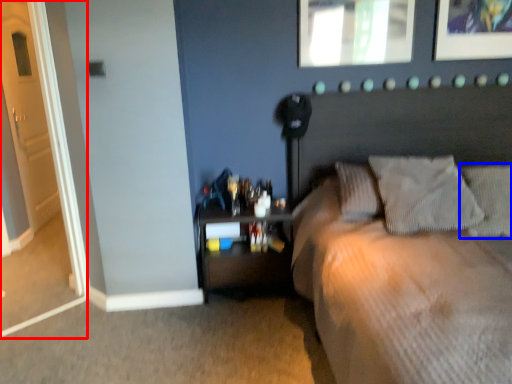
Question: Which point is closer to the camera, door (highlighted by a red box) or pillow (highlighted by a blue box)?

Choices:
 (A) door
 (B) pillow

Answer: (A)